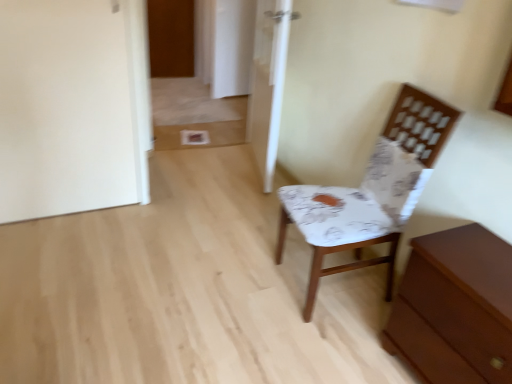
At what (x,y) coordinates should I click in order to perform the action: click on vacant location below white fabric chair at right (from a real-world perspective). Please return your answer as a coordinate pair (x, y). Looking at the image, I should click on (328, 284).